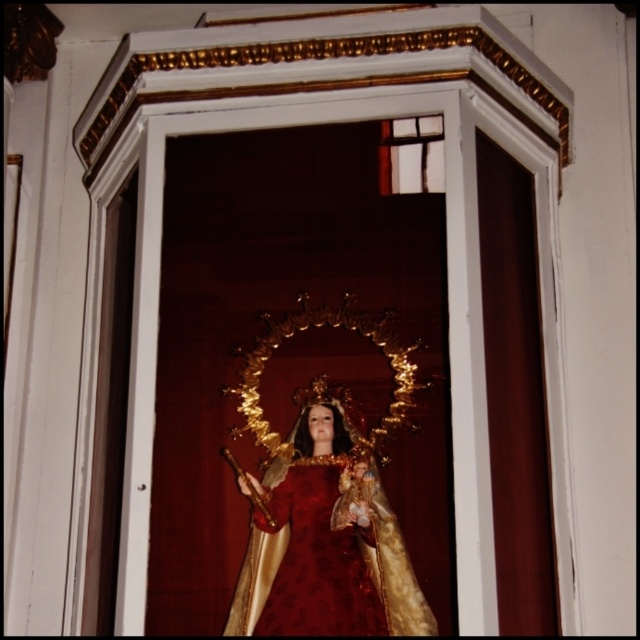
Which is above, velvet gold statue at center or velvet rich red dress at center?

velvet gold statue at center is above.

Between velvet gold statue at center and velvet rich red dress at center, which one appears on the right side from the viewer's perspective?

velvet rich red dress at center is more to the right.

Does point (330, 529) come closer to viewer compared to point (324, 596)?

No, (330, 529) is behind (324, 596).

At what (x,y) coordinates should I click in order to perform the action: click on velvet gold statue at center. Please return your answer as a coordinate pair (x, y). This screenshot has width=640, height=640. Looking at the image, I should click on (328, 541).